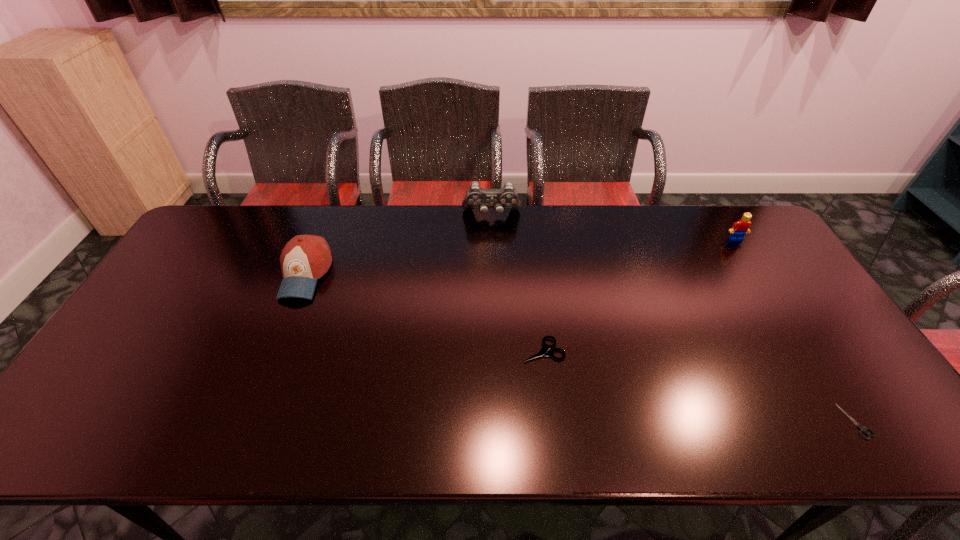
This screenshot has width=960, height=540. Identify the location of vacant space that's between the left shears and the second farthest object. (639, 295).

The width and height of the screenshot is (960, 540). Find the location of `vacant region between the farthest object and the leftmost object`. vacant region between the farthest object and the leftmost object is located at coordinates (398, 245).

Identify the location of empty space that is in between the taller shears and the shorter shears. (699, 386).

At what (x,y) coordinates should I click in order to perform the action: click on vacant area that lies between the nearest object and the second farthest object. Please return your answer as a coordinate pair (x, y). Looking at the image, I should click on (796, 330).

Image resolution: width=960 pixels, height=540 pixels. I want to click on free spot between the fourth farthest object and the Lego, so click(639, 295).

At what (x,y) coordinates should I click in order to perform the action: click on free space between the shortest object and the Lego. Please return your answer as a coordinate pair (x, y). The width and height of the screenshot is (960, 540). Looking at the image, I should click on (796, 330).

Identify which object is located as the third nearest to the right shears. Please provide its 2D coordinates. Your answer should be formatted as a tuple, i.e. [(x, y)], where the tuple contains the x and y coordinates of a point satisfying the conditions above.

[(476, 197)]

Identify which object is the nearest to the Lego. Please provide its 2D coordinates. Your answer should be formatted as a tuple, i.e. [(x, y)], where the tuple contains the x and y coordinates of a point satisfying the conditions above.

[(862, 429)]

What are the coordinates of `free location that satisfies the following two spatial constraints: 1. on the front-facing side of the second farthest object; 2. on the left side of the nearer shears` in the screenshot? It's located at (851, 421).

You are a GUI agent. You are given a task and a screenshot of the screen. Output one action in this format:
    pyautogui.click(x=<x>, y=<y>)
    Task: Click on the free space that satisfies the following two spatial constraints: 1. on the surface of the farthest object with buttons; 2. on the right side of the fourth tallest object
    
    Given the screenshot: What is the action you would take?
    pyautogui.click(x=495, y=350)